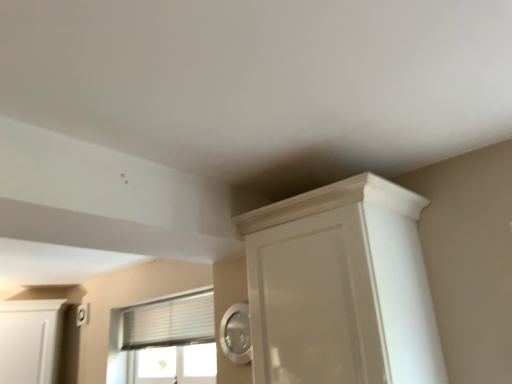
Question: Does white glossy cupboard at upper right appear on the left side of white textured window at center?

Choices:
 (A) yes
 (B) no

Answer: (B)

Question: Is white glossy cupboard at upper right in front of white textured window at center?

Choices:
 (A) yes
 (B) no

Answer: (A)

Question: Considering the relative sizes of white glossy cupboard at upper right and white textured window at center in the image provided, is white glossy cupboard at upper right taller than white textured window at center?

Choices:
 (A) no
 (B) yes

Answer: (B)

Question: Is white glossy cupboard at upper right not close to white textured window at center?

Choices:
 (A) no
 (B) yes

Answer: (B)

Question: Is white glossy cupboard at upper right facing away from white textured window at center?

Choices:
 (A) no
 (B) yes

Answer: (A)

Question: From a real-world perspective, relative to white textured window at center, is white matte cabinet at left vertically above or below?

Choices:
 (A) below
 (B) above

Answer: (A)

Question: From the image's perspective, is white matte cabinet at left located above or below white textured window at center?

Choices:
 (A) above
 (B) below

Answer: (B)

Question: Based on their sizes in the image, would you say white matte cabinet at left is bigger or smaller than white textured window at center?

Choices:
 (A) small
 (B) big

Answer: (B)

Question: Is point pos(56,352) closer or farther from the camera than point pos(147,354)?

Choices:
 (A) farther
 (B) closer

Answer: (A)

Question: Would you say white textured window at center is inside or outside white matte cabinet at left?

Choices:
 (A) inside
 (B) outside

Answer: (B)

Question: Considering the positions of white textured window at center and white matte cabinet at left in the image, is white textured window at center wider or thinner than white matte cabinet at left?

Choices:
 (A) wide
 (B) thin

Answer: (B)

Question: From their relative heights in the image, would you say white textured window at center is taller or shorter than white matte cabinet at left?

Choices:
 (A) tall
 (B) short

Answer: (B)

Question: From the image's perspective, is white textured window at center above or below white matte cabinet at left?

Choices:
 (A) below
 (B) above

Answer: (B)

Question: Is point (4, 301) closer or farther from the camera than point (368, 244)?

Choices:
 (A) farther
 (B) closer

Answer: (A)

Question: Is white matte cabinet at left spatially inside white glossy cupboard at upper right, or outside of it?

Choices:
 (A) inside
 (B) outside

Answer: (B)